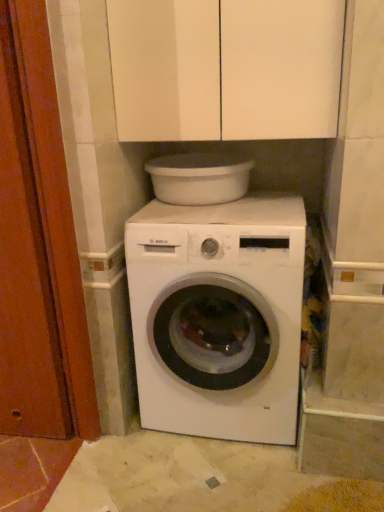
Question: Is wooden door at left further to the viewer compared to white matte washing machine at center?

Choices:
 (A) no
 (B) yes

Answer: (A)

Question: Does wooden door at left have a smaller size compared to white matte washing machine at center?

Choices:
 (A) no
 (B) yes

Answer: (B)

Question: Does wooden door at left have a lesser height compared to white matte washing machine at center?

Choices:
 (A) no
 (B) yes

Answer: (A)

Question: Does wooden door at left appear on the right side of white matte washing machine at center?

Choices:
 (A) no
 (B) yes

Answer: (A)

Question: Is wooden door at left taller than white matte washing machine at center?

Choices:
 (A) no
 (B) yes

Answer: (B)

Question: Is white matte cabinet at upper center wider or thinner than white plastic basin at upper center?

Choices:
 (A) thin
 (B) wide

Answer: (B)

Question: Considering the relative positions of white matte cabinet at upper center and white plastic basin at upper center in the image provided, is white matte cabinet at upper center to the left or to the right of white plastic basin at upper center?

Choices:
 (A) left
 (B) right

Answer: (B)

Question: Considering the positions of white matte cabinet at upper center and white plastic basin at upper center in the image, is white matte cabinet at upper center bigger or smaller than white plastic basin at upper center?

Choices:
 (A) small
 (B) big

Answer: (B)

Question: In terms of height, does white matte cabinet at upper center look taller or shorter compared to white plastic basin at upper center?

Choices:
 (A) short
 (B) tall

Answer: (B)

Question: From the image's perspective, relative to white matte washing machine at center, is wooden door at left above or below?

Choices:
 (A) above
 (B) below

Answer: (A)

Question: Would you say wooden door at left is to the left or to the right of white matte washing machine at center in the picture?

Choices:
 (A) left
 (B) right

Answer: (A)

Question: In the image, is wooden door at left positioned in front of or behind white matte washing machine at center?

Choices:
 (A) behind
 (B) front

Answer: (B)

Question: Is wooden door at left inside the boundaries of white matte washing machine at center, or outside?

Choices:
 (A) outside
 (B) inside

Answer: (A)

Question: Is point (170, 164) positioned closer to the camera than point (288, 329)?

Choices:
 (A) farther
 (B) closer

Answer: (A)

Question: Is white plastic basin at upper center in front of or behind white matte washing machine at center in the image?

Choices:
 (A) front
 (B) behind

Answer: (B)